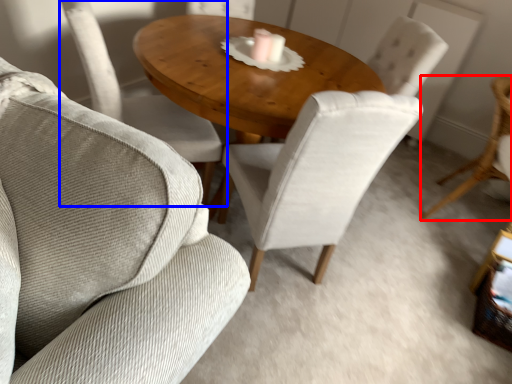
Question: Which object appears closest to the camera in this image, chair (highlighted by a red box) or chair (highlighted by a blue box)?

Choices:
 (A) chair
 (B) chair

Answer: (B)